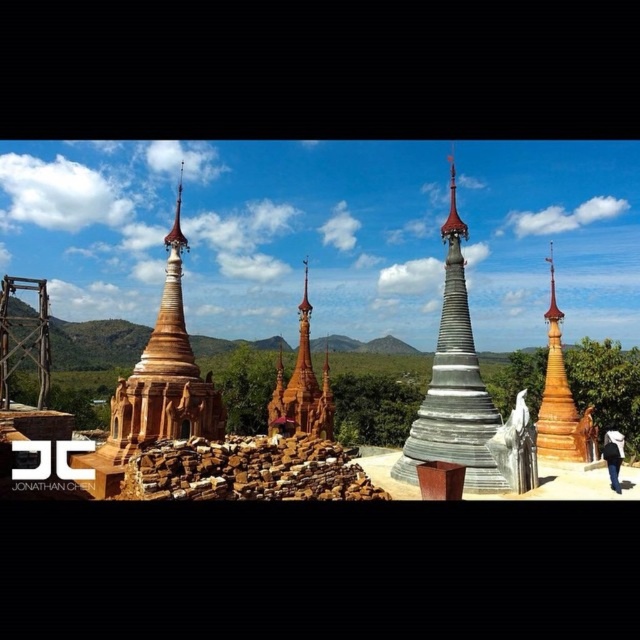
Question: Among these objects, which one is farthest from the camera?

Choices:
 (A) white fabric bag at lower right
 (B) wooden temple at center

Answer: (B)

Question: Can you confirm if silver metallic stupa at center is thinner than white fabric bag at lower right?

Choices:
 (A) no
 (B) yes

Answer: (A)

Question: Is matte brown pagoda at left thinner than white fabric bag at lower right?

Choices:
 (A) yes
 (B) no

Answer: (B)

Question: Does silver metallic stupa at center appear on the right side of white fabric bag at lower right?

Choices:
 (A) no
 (B) yes

Answer: (A)

Question: Which of the following is the closest to the observer?

Choices:
 (A) wooden temple at center
 (B) silver metallic stupa at center

Answer: (B)

Question: Among these points, which one is nearest to the camera?

Choices:
 (A) (474, 412)
 (B) (186, 403)

Answer: (B)